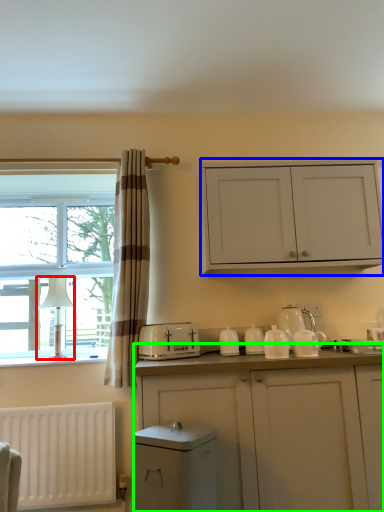
Question: Based on their relative distances, which object is farther from lamp (highlighted by a red box)? Choose from cabinetry (highlighted by a blue box) and cabinetry (highlighted by a green box).

Choices:
 (A) cabinetry
 (B) cabinetry

Answer: (B)